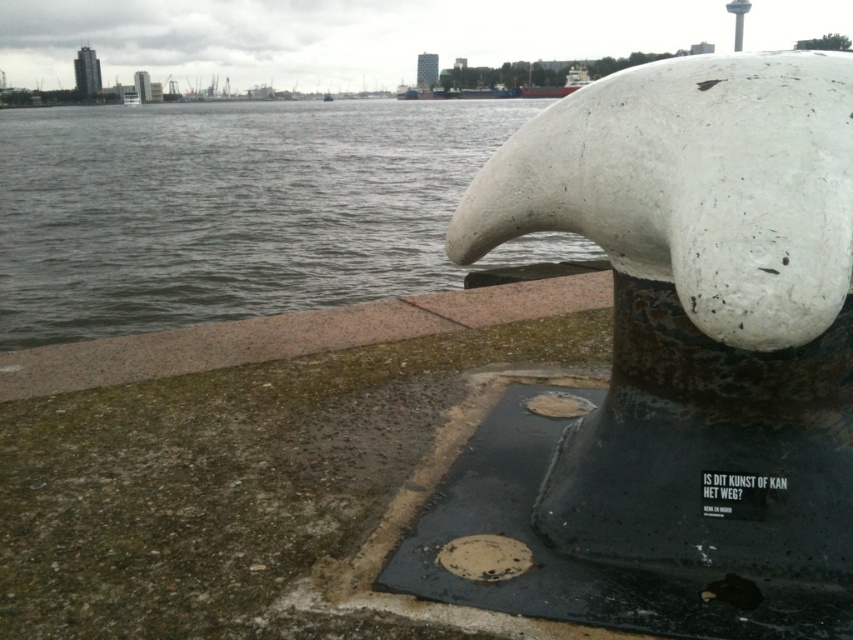
Question: Is white matte sculpture at center wider than gray water at upper left?

Choices:
 (A) yes
 (B) no

Answer: (B)

Question: Among these objects, which one is farthest from the camera?

Choices:
 (A) white matte sculpture at center
 (B) gray water at upper left

Answer: (B)

Question: Among these objects, which one is farthest from the camera?

Choices:
 (A) gray water at upper left
 (B) white matte sculpture at center

Answer: (A)

Question: Is white matte sculpture at center bigger than gray water at upper left?

Choices:
 (A) yes
 (B) no

Answer: (B)

Question: Is white matte sculpture at center smaller than gray water at upper left?

Choices:
 (A) no
 (B) yes

Answer: (B)

Question: Which of the following is the closest to the observer?

Choices:
 (A) white matte sculpture at center
 (B) gray water at upper left

Answer: (A)